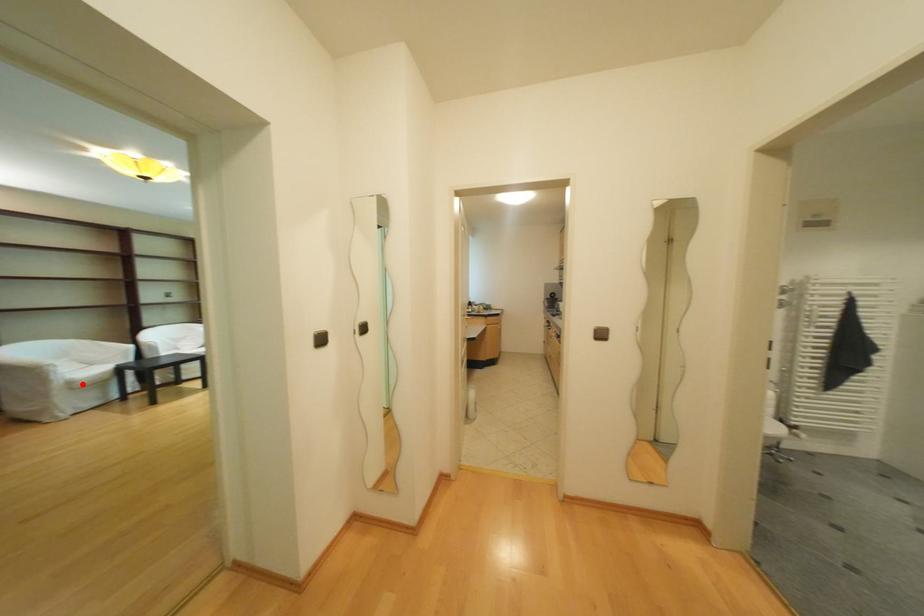
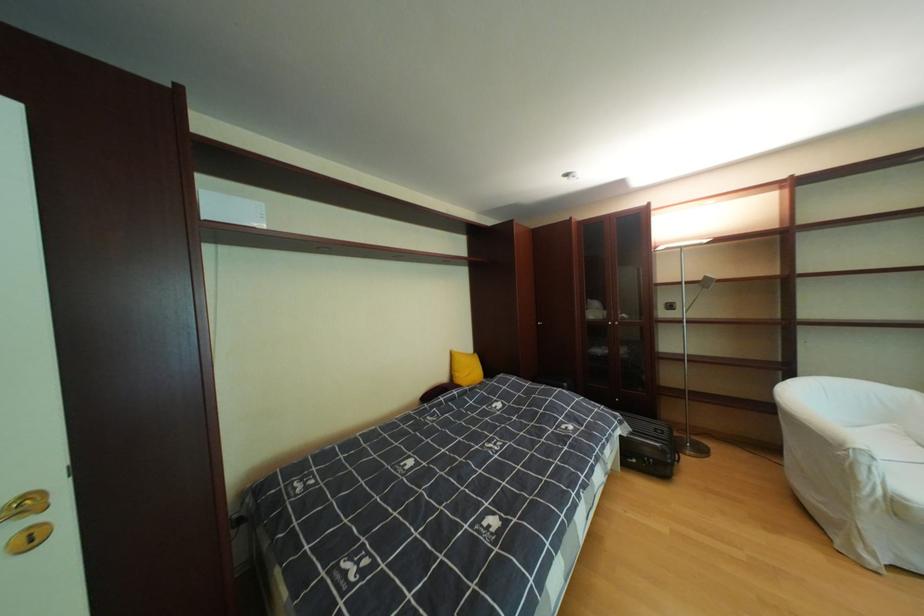
Question: I am providing you with two images of the same scene from different viewpoints. Image1 has a red point marked. In image2, the corresponding 3D location appears at what relative position? Reply with the corresponding letter.

Choices:
 (A) Closer
 (B) Farther

Answer: (A)